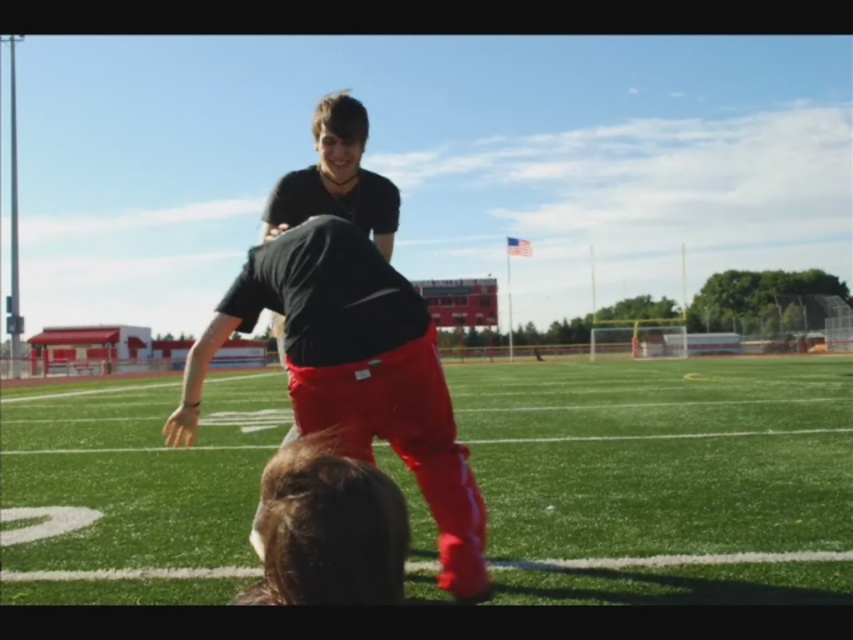
Question: Is green grass football field at center in front of matte black shirt at center?

Choices:
 (A) no
 (B) yes

Answer: (A)

Question: Is green grass football field at center smaller than matte black shirt at center?

Choices:
 (A) no
 (B) yes

Answer: (A)

Question: Considering the relative positions of green grass football field at center and matte black shirt at center in the image provided, where is green grass football field at center located with respect to matte black shirt at center?

Choices:
 (A) below
 (B) above

Answer: (A)

Question: Which point is farther from the camera taking this photo?

Choices:
 (A) (370, 340)
 (B) (752, 548)

Answer: (B)